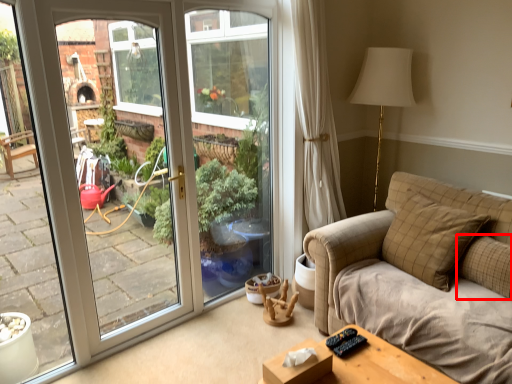
Question: Observing the image, what is the correct spatial positioning of pillow (annotated by the red box) in reference to pillow?

Choices:
 (A) left
 (B) right

Answer: (B)